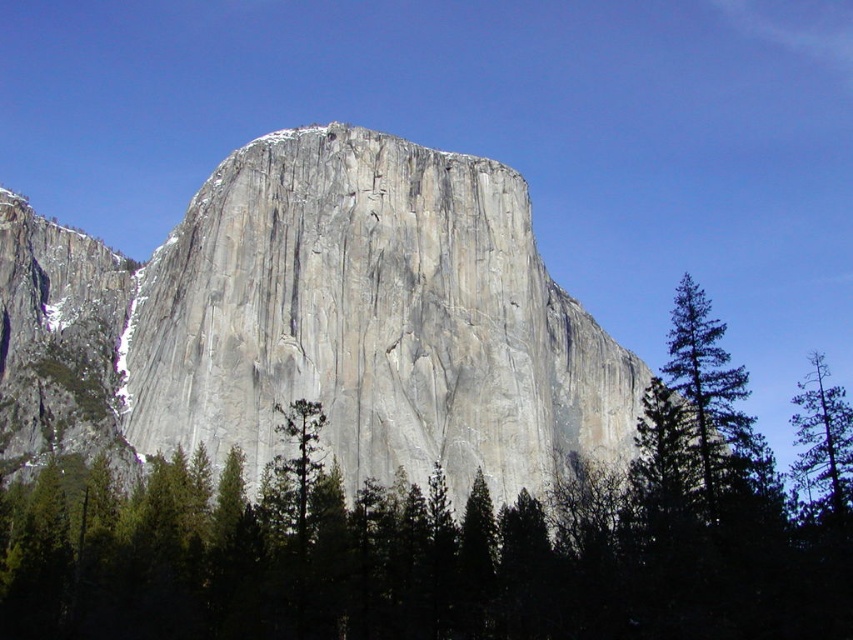
You are standing at the base of El Capitan and want to reach a specific point marked at coordinates point (309, 173). If your current distance to the rock formation is 100 meters, can you safely approach this point without getting too close to the rock?

The distance of point (309, 173) from viewer is 103.31 meters, which is slightly beyond your current position at 100 meters away from the rock formation. You can safely approach this point as it is not too close to the rock.

You are a hiker standing at the base of the gray rock formation at center. You want to climb to the top, which is 3,000 feet high. If you climb at a rate of 10 feet per minute, how long will it take you to reach the summit?

The gray rock formation at center is 3,000 feet high. Climbing at 10 feet per minute, it would take 3,000 divided by 10 equals 300 minutes, which is 5 hours. However, the question mentions the distance between the rock and the viewer is 273.03 feet, but that detail isn

You are a hiker standing at the base of the rock formation and notice two green trees on your right side. Which of the two trees, the green coniferous tree at right or the green textured tree at right, has a narrower width?

The green coniferous tree at right has a lesser width compared to the green textured tree at right, so it is narrower.